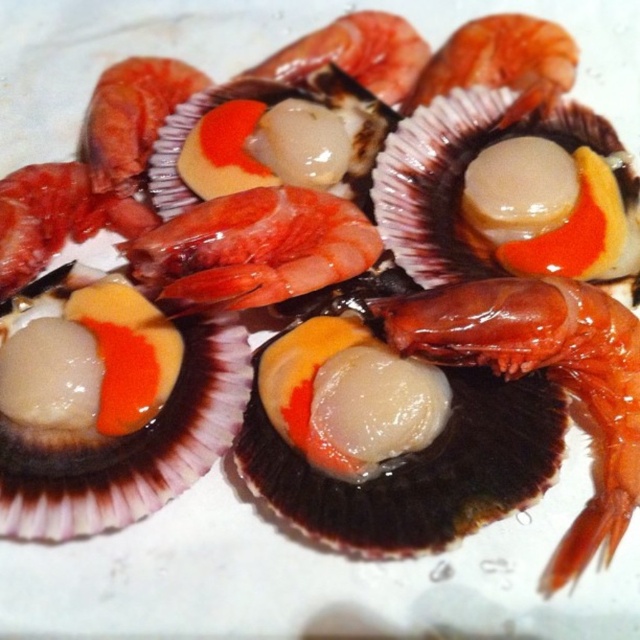
You are a food critic observing the arrangement of the translucent gelatinous shrimp at upper center and the translucent gelatinous shrimp at center on the plate. Which shrimp is positioned closer to your eyes?

The translucent gelatinous shrimp at upper center is closer to the viewer than the translucent gelatinous shrimp at center.

You are a food photographer setting up a shot of the seafood arrangement. You need to adjust the lighting so that the point at position [557,93] and the point at position [92,129] are both well illuminated. Since one is behind the other, which point should you focus the light on first to ensure both are properly lit?

Point at position [557,93] is behind point at position [92,129]. To ensure both are well lit, focus the light on the point at position [92,129] first, as it is closer to the camera. This way, the light will naturally reach the point behind it as well.